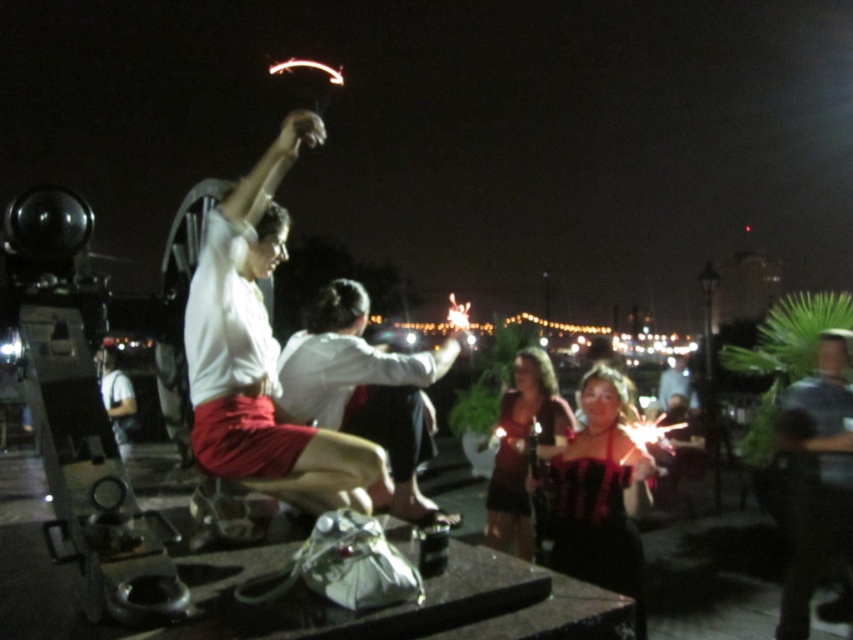
Can you confirm if white shirt at center is positioned below black velvet dress at center?

Actually, white shirt at center is above black velvet dress at center.

Based on the photo, is white shirt at center above black velvet dress at center?

Yes, white shirt at center is above black velvet dress at center.

Does point (428, 458) lie behind point (606, 534)?

No, (428, 458) is in front of (606, 534).

The width and height of the screenshot is (853, 640). In order to click on white shirt at center in this screenshot , I will do `click(364, 387)`.

Is point (834, 452) less distant than point (521, 397)?

That is True.

Between point (805, 444) and point (525, 464), which one is positioned behind?

The point (525, 464) is more distant.

Is point (843, 419) closer to viewer compared to point (509, 396)?

Yes, it is.

You are a GUI agent. You are given a task and a screenshot of the screen. Output one action in this format:
    pyautogui.click(x=<x>, y=<y>)
    Task: Click on the dark blue shirt at right
    The image size is (853, 640).
    Given the screenshot: What is the action you would take?
    pyautogui.click(x=816, y=476)

Who is higher up, white matte shirt at center or white shirt at center?

white matte shirt at center is above.

In the scene shown: Does white matte shirt at center have a greater height compared to white shirt at center?

Yes.

Is point (273, 161) positioned in front of point (335, 330)?

Yes, it is in front of point (335, 330).

Where is `white matte shirt at center`? white matte shirt at center is located at coordinates coord(262,355).